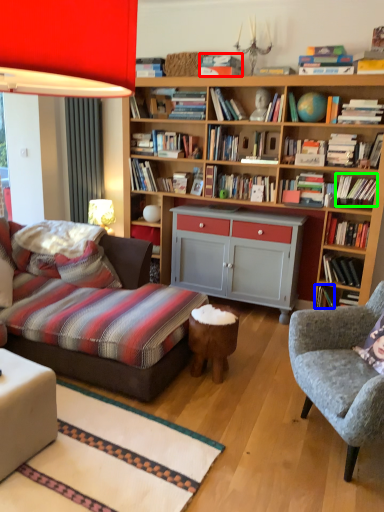
Question: Considering the real-world distances, which object is closest to book (highlighted by a red box)? book (highlighted by a blue box) or book (highlighted by a green box).

Choices:
 (A) book
 (B) book

Answer: (B)